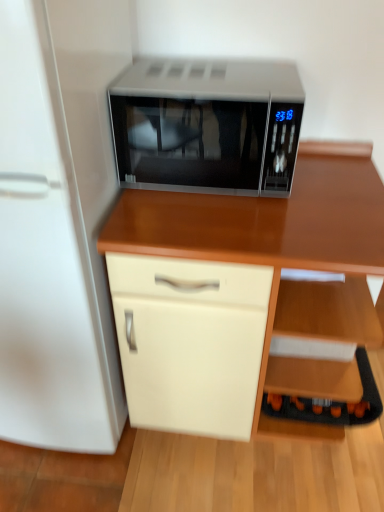
Question: Does black plastic shelf at lower right have a smaller size compared to wooden desk at center?

Choices:
 (A) yes
 (B) no

Answer: (A)

Question: Considering the relative positions of black plastic shelf at lower right and wooden desk at center in the image provided, is black plastic shelf at lower right behind wooden desk at center?

Choices:
 (A) no
 (B) yes

Answer: (B)

Question: Is black plastic shelf at lower right at the left side of wooden desk at center?

Choices:
 (A) no
 (B) yes

Answer: (A)

Question: Is black plastic shelf at lower right touching wooden desk at center?

Choices:
 (A) no
 (B) yes

Answer: (A)

Question: Is black plastic shelf at lower right not within wooden desk at center?

Choices:
 (A) yes
 (B) no

Answer: (B)

Question: Does black plastic shelf at lower right have a greater width compared to wooden desk at center?

Choices:
 (A) no
 (B) yes

Answer: (A)

Question: Does sleek silver microwave at center appear on the right side of wooden desk at center?

Choices:
 (A) no
 (B) yes

Answer: (A)

Question: From a real-world perspective, is sleek silver microwave at center positioned under wooden desk at center based on gravity?

Choices:
 (A) yes
 (B) no

Answer: (B)

Question: Considering the relative positions of sleek silver microwave at center and wooden desk at center in the image provided, is sleek silver microwave at center to the left of wooden desk at center from the viewer's perspective?

Choices:
 (A) no
 (B) yes

Answer: (B)

Question: Considering the relative sizes of sleek silver microwave at center and wooden desk at center in the image provided, is sleek silver microwave at center thinner than wooden desk at center?

Choices:
 (A) yes
 (B) no

Answer: (A)

Question: Is wooden desk at center a part of sleek silver microwave at center?

Choices:
 (A) no
 (B) yes

Answer: (A)

Question: Is sleek silver microwave at center facing towards wooden desk at center?

Choices:
 (A) yes
 (B) no

Answer: (B)

Question: Could you tell me if white glossy refrigerator at left is facing black plastic shelf at lower right?

Choices:
 (A) yes
 (B) no

Answer: (B)